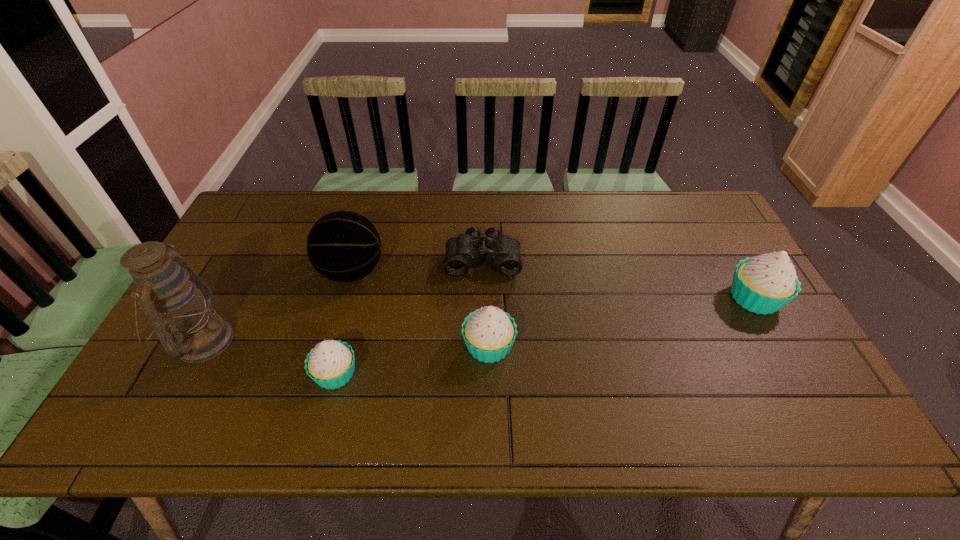
Identify the location of vacant region located on the left of the leftmost cupcake. The width and height of the screenshot is (960, 540). (262, 374).

At what (x,y) coordinates should I click in order to perform the action: click on vacant space located on the left of the second tallest cupcake. Please return your answer as a coordinate pair (x, y). This screenshot has width=960, height=540. Looking at the image, I should click on (435, 346).

The width and height of the screenshot is (960, 540). Find the location of `vacant space located on the left of the farthest cupcake`. vacant space located on the left of the farthest cupcake is located at coordinates (644, 298).

This screenshot has width=960, height=540. In order to click on vacant space located on the right of the tallest object in this screenshot , I will do `click(341, 341)`.

Where is `free spot located at the eyepieces of the shortest object`? This screenshot has width=960, height=540. free spot located at the eyepieces of the shortest object is located at coordinates (483, 300).

At what (x,y) coordinates should I click in order to perform the action: click on free space located 0.240m on the right of the basketball. Please return your answer as a coordinate pair (x, y). Looking at the image, I should click on (467, 272).

Find the location of `oil lamp at the near edge`. oil lamp at the near edge is located at coordinates (169, 292).

Image resolution: width=960 pixels, height=540 pixels. I want to click on object that is positioned at the left edge, so click(x=169, y=292).

In order to click on object that is positioned at the right edge in this screenshot , I will do `click(764, 284)`.

What are the coordinates of `object that is at the near left corner` in the screenshot? It's located at (169, 292).